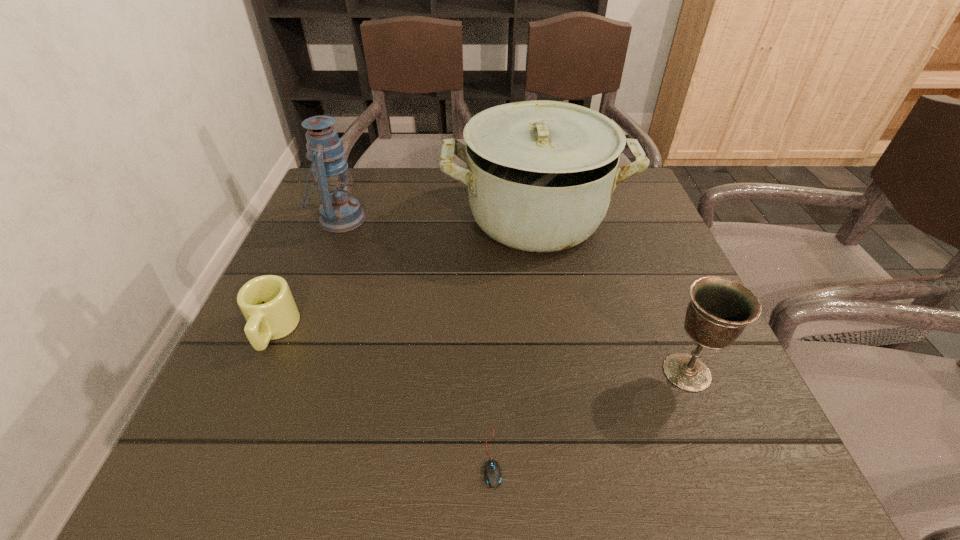
Find the location of a particular element. The width and height of the screenshot is (960, 540). free space that is in between the mug and the lantern is located at coordinates (307, 275).

At what (x,y) coordinates should I click in order to perform the action: click on vacant space that is in between the chalice and the mug. Please return your answer as a coordinate pair (x, y). Looking at the image, I should click on (480, 352).

Where is `vacant space that is in between the saucepan and the second shortest object`? Image resolution: width=960 pixels, height=540 pixels. vacant space that is in between the saucepan and the second shortest object is located at coordinates (404, 274).

Where is `empty space that is in between the mouse and the saucepan`? empty space that is in between the mouse and the saucepan is located at coordinates (514, 338).

Image resolution: width=960 pixels, height=540 pixels. Identify the location of unoccupied area between the mug and the mouse. (383, 394).

You are a GUI agent. You are given a task and a screenshot of the screen. Output one action in this format:
    pyautogui.click(x=<x>, y=<y>)
    Task: Click on the unoccupied area between the third tallest object and the mug
    The height and width of the screenshot is (540, 960).
    Given the screenshot: What is the action you would take?
    pyautogui.click(x=480, y=352)

Find the location of a particular element. free spot between the nearest object and the second shortest object is located at coordinates pyautogui.click(x=383, y=394).

This screenshot has width=960, height=540. Identify the location of object identified as the third closest to the shortest object. (540, 174).

Point out which object is positioned as the second nearest to the saucepan. Please provide its 2D coordinates. Your answer should be formatted as a tuple, i.e. [(x, y)], where the tuple contains the x and y coordinates of a point satisfying the conditions above.

[(719, 310)]

At what (x,y) coordinates should I click in order to perform the action: click on vacant space that satisfies the following two spatial constraints: 1. on the back side of the chalice; 2. on the front-facing side of the lantern. Please return your answer as a coordinate pair (x, y). Looking at the image, I should click on click(x=624, y=219).